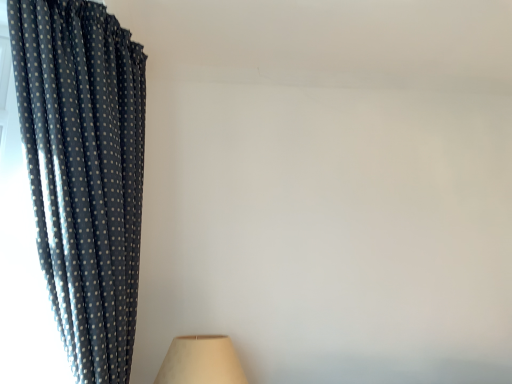
Question: From the image's perspective, is dark blue polka dot fabric at left positioned above or below beige fabric lampshade at lower left?

Choices:
 (A) below
 (B) above

Answer: (B)

Question: Looking at the image, does dark blue polka dot fabric at left seem bigger or smaller compared to beige fabric lampshade at lower left?

Choices:
 (A) big
 (B) small

Answer: (A)

Question: Choose the correct answer: Is dark blue polka dot fabric at left inside beige fabric lampshade at lower left or outside it?

Choices:
 (A) inside
 (B) outside

Answer: (B)

Question: Based on their sizes in the image, would you say beige fabric lampshade at lower left is bigger or smaller than dark blue polka dot fabric at left?

Choices:
 (A) big
 (B) small

Answer: (B)

Question: Do you think beige fabric lampshade at lower left is within dark blue polka dot fabric at left, or outside of it?

Choices:
 (A) outside
 (B) inside

Answer: (A)

Question: Considering the positions of beige fabric lampshade at lower left and dark blue polka dot fabric at left in the image, is beige fabric lampshade at lower left taller or shorter than dark blue polka dot fabric at left?

Choices:
 (A) short
 (B) tall

Answer: (A)

Question: Considering the positions of point (227, 379) and point (122, 142), is point (227, 379) closer or farther from the camera than point (122, 142)?

Choices:
 (A) closer
 (B) farther

Answer: (B)